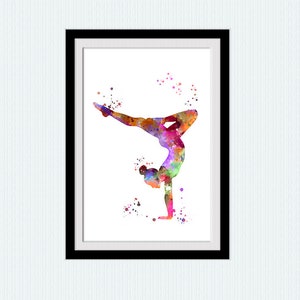
Locate an element on the screen. Image resolution: width=300 pixels, height=300 pixels. frame is located at coordinates (81, 243).